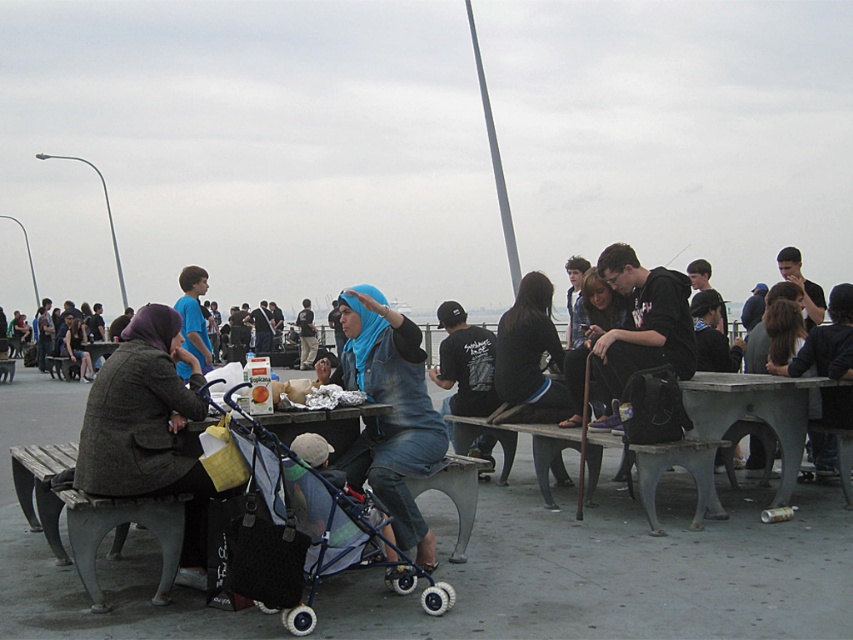
You are a GUI agent. You are given a task and a screenshot of the screen. Output one action in this format:
    pyautogui.click(x=<x>, y=<y>)
    Task: Click on the black fabric stroller at center
    The image size is (853, 640).
    Given the screenshot: What is the action you would take?
    pyautogui.click(x=292, y=525)

Does black fabric stroller at center lie in front of dark blue t-shirt at center?

Yes, it is in front of dark blue t-shirt at center.

What are the coordinates of `black fabric stroller at center` in the screenshot? It's located at (292, 525).

Does gray concrete table at center come in front of blue t-shirt at center?

Yes, gray concrete table at center is in front of blue t-shirt at center.

Is point (786, 449) behind point (183, 326)?

No.

The width and height of the screenshot is (853, 640). I want to click on gray concrete table at center, so click(x=753, y=412).

Identify the location of gray concrete table at center. (753, 412).

Who is positioned more to the left, dark blue t-shirt at center or denim jacket at center?

From the viewer's perspective, denim jacket at center appears more on the left side.

Does dark blue t-shirt at center appear on the left side of denim jacket at center?

No, dark blue t-shirt at center is not to the left of denim jacket at center.

Who is more distant from viewer, (488, 449) or (299, 368)?

The point (299, 368) is behind.

Identify the location of dark blue t-shirt at center. The image size is (853, 640). (463, 364).